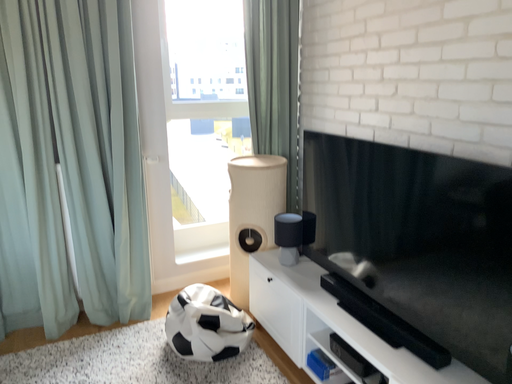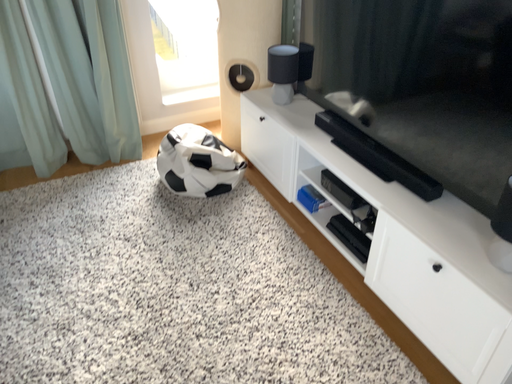
Question: Which way did the camera rotate in the video?

Choices:
 (A) rotated downward
 (B) rotated upward

Answer: (A)